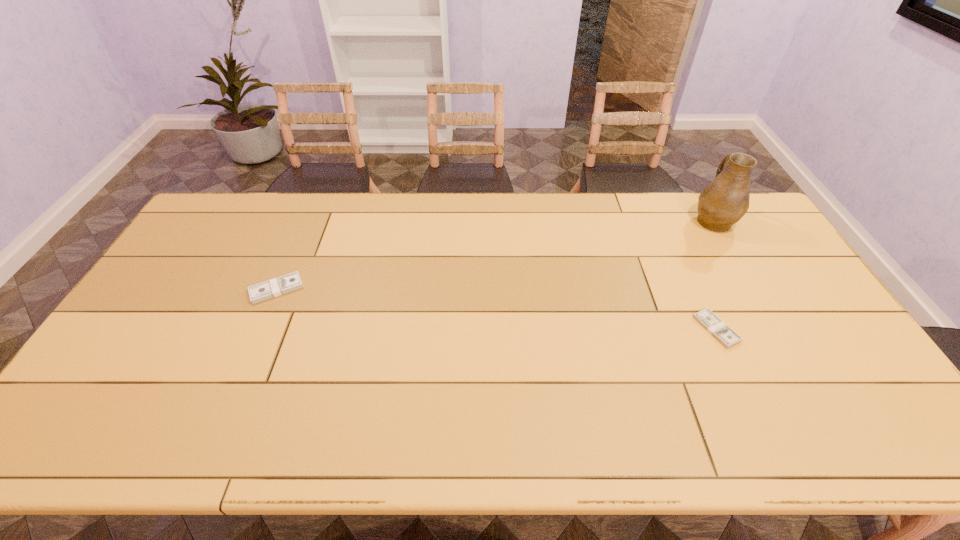
What are the coordinates of `object positioned at the far right corner` in the screenshot? It's located at (722, 203).

The height and width of the screenshot is (540, 960). I want to click on vacant space at the far edge of the desktop, so click(349, 208).

Locate an element on the screen. vacant space at the near edge of the desktop is located at coordinates (812, 443).

What are the coordinates of `vacant space at the left edge of the desktop` in the screenshot? It's located at (117, 355).

Locate an element on the screen. vacant space at the right edge is located at coordinates pyautogui.click(x=758, y=262).

Where is `empty location between the pitcher and the left dollar`? The image size is (960, 540). empty location between the pitcher and the left dollar is located at coordinates (494, 255).

Locate an element on the screen. unoccupied position between the nearer dollar and the leftmost object is located at coordinates (496, 309).

At what (x,y) coordinates should I click in order to perform the action: click on empty location between the second object from left to right and the pitcher. Please return your answer as a coordinate pair (x, y). Looking at the image, I should click on pos(714,275).

Where is `free spot between the second object from left to right and the leftmost object`? free spot between the second object from left to right and the leftmost object is located at coordinates (496, 309).

I want to click on vacant point located between the rightmost object and the shorter dollar, so click(714, 275).